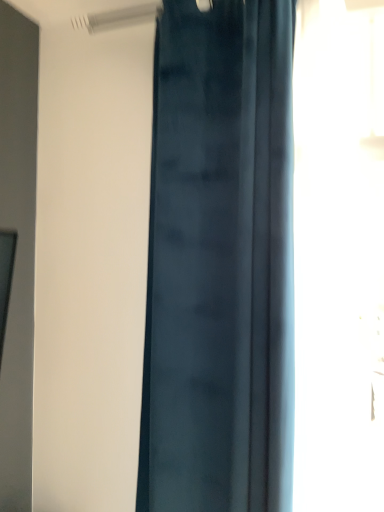
Question: Based on their sizes in the image, would you say transparent glass window at right is bigger or smaller than satin blue curtain at center?

Choices:
 (A) small
 (B) big

Answer: (A)

Question: From a real-world perspective, is transparent glass window at right above or below satin blue curtain at center?

Choices:
 (A) above
 (B) below

Answer: (A)

Question: Is transparent glass window at right taller or shorter than satin blue curtain at center?

Choices:
 (A) tall
 (B) short

Answer: (B)

Question: From their relative heights in the image, would you say satin blue curtain at center is taller or shorter than transparent glass window at right?

Choices:
 (A) tall
 (B) short

Answer: (A)

Question: Which is correct: satin blue curtain at center is inside transparent glass window at right, or outside of it?

Choices:
 (A) outside
 (B) inside

Answer: (A)

Question: From a real-world perspective, is satin blue curtain at center positioned above or below transparent glass window at right?

Choices:
 (A) above
 (B) below

Answer: (B)

Question: Considering the positions of point (160, 364) and point (382, 315), is point (160, 364) closer or farther from the camera than point (382, 315)?

Choices:
 (A) closer
 (B) farther

Answer: (B)